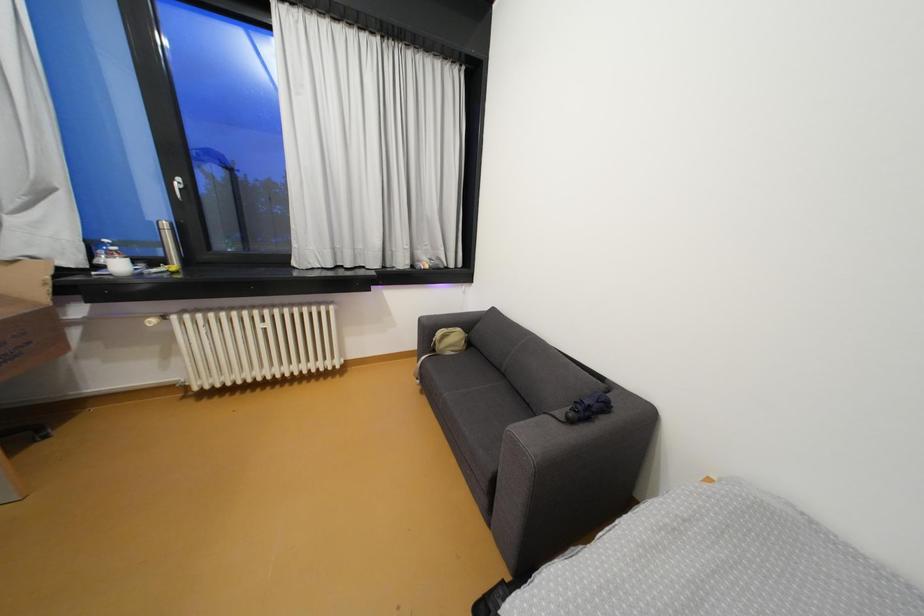
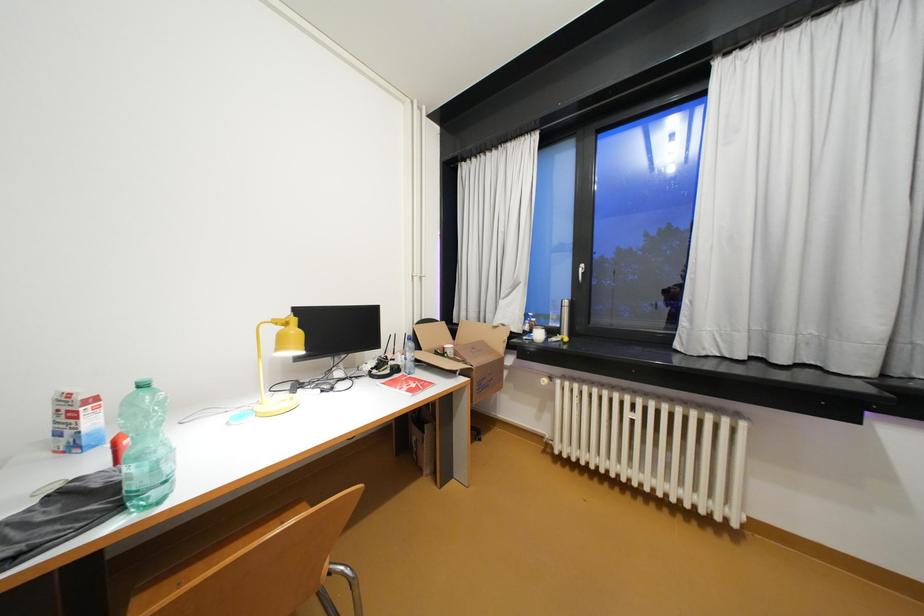
Question: How did the camera likely rotate?

Choices:
 (A) Left
 (B) Right
 (C) Up
 (D) Down

Answer: (A)